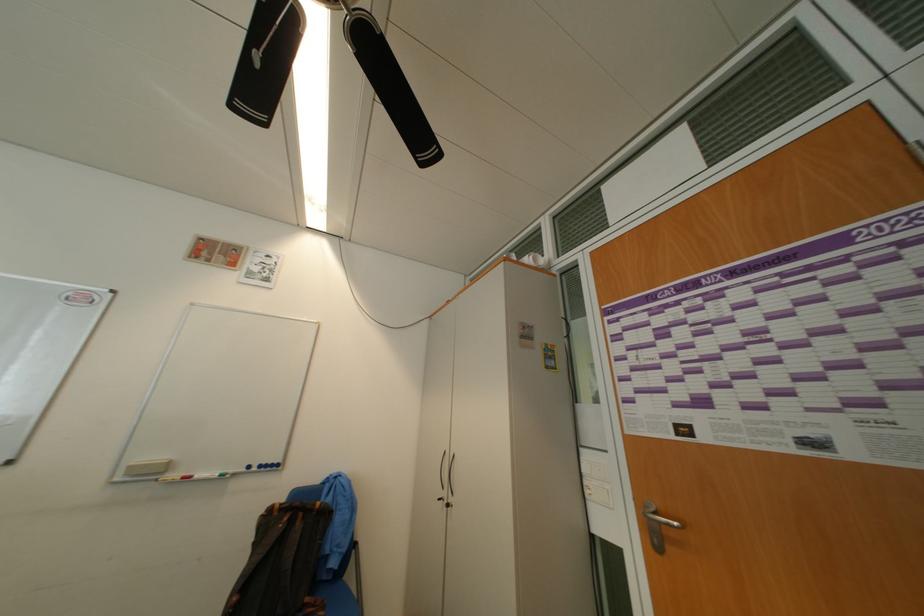
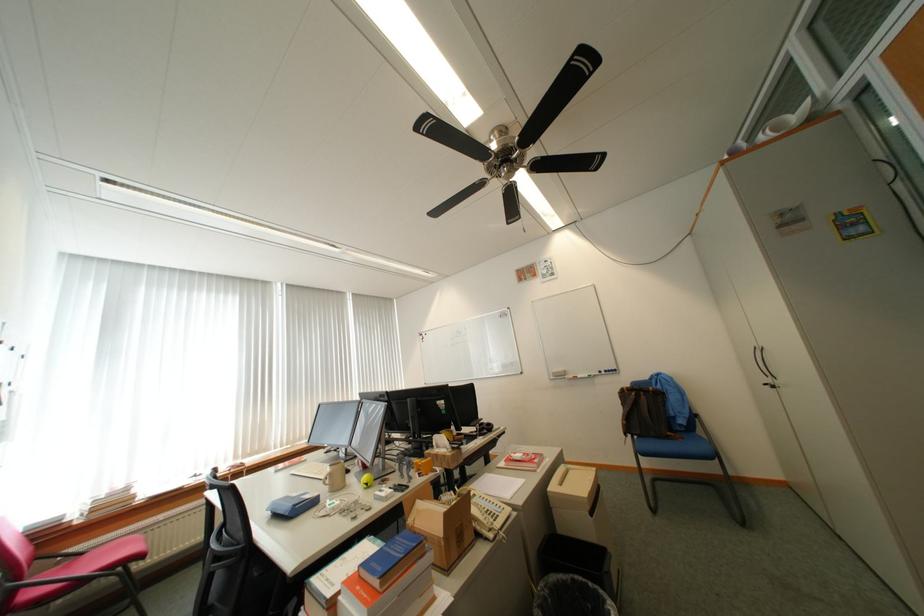
Find the pixel in the second image that matches [309,525] in the first image.

(652, 399)